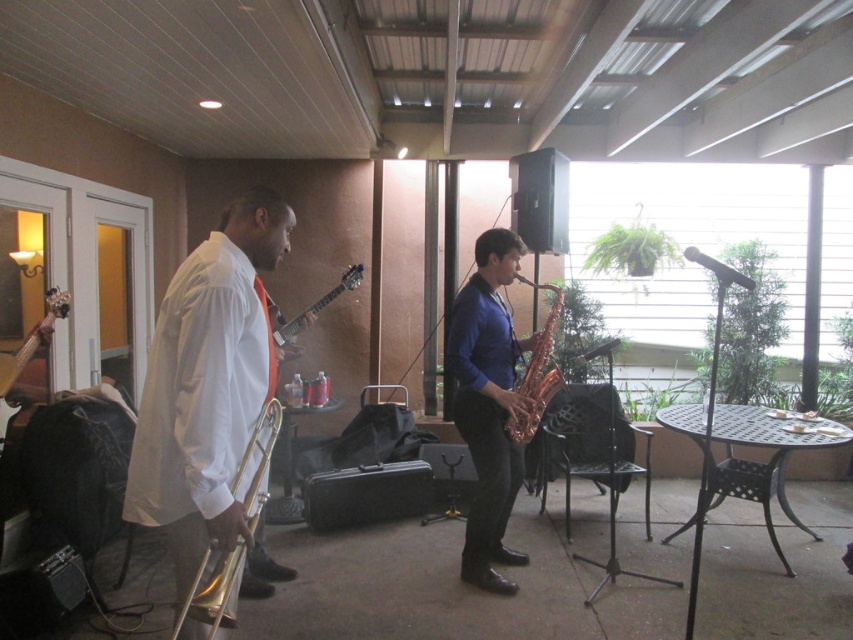
You are a stagehand standing at the edge of the performance area. You need to hand a microphone to the musician playing the shiny gold trombone at left. The microphone is 1.5 meters away from you. Can you reach it without moving your feet?

The shiny gold trombone at left is 1.86 meters away from you, which is further than the 1.5 meter distance of the microphone. Therefore, you cannot reach the microphone without moving your feet.

Where is the gold shiny saxophone at center located in the image?

The gold shiny saxophone at center is located at point coordinates of 0.581 on the x axis and 0.631 on the y axis.

You are a photographer setting up for a live music performance. You want to capture a shot where the gold shiny saxophone at center is visible without being blocked by the wooden acoustic guitar at left. Based on the scene description, is this possible?

The gold shiny saxophone at center is positioned under the wooden acoustic guitar at left, so it might be partially or fully blocked depending on the angle. To ensure visibility, adjust your position so that the saxophone is not directly beneath the guitar.